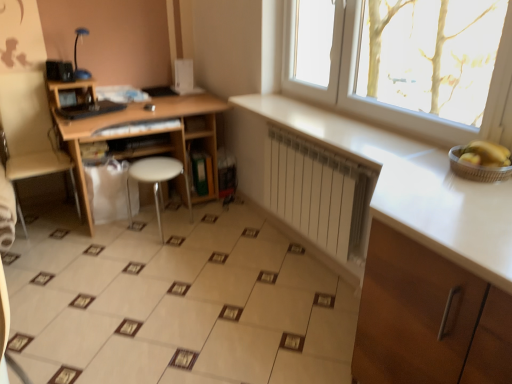
Describe the element at coordinates (160, 180) in the screenshot. I see `white plastic stool at center` at that location.

The width and height of the screenshot is (512, 384). Identify the location of white plastic stool at center. (160, 180).

Where is `beige fabric swivel chair at left`? The image size is (512, 384). beige fabric swivel chair at left is located at coordinates (30, 133).

What do you see at coordinates (30, 133) in the screenshot?
I see `beige fabric swivel chair at left` at bounding box center [30, 133].

At what (x,y) coordinates should I click in order to perform the action: click on metallic silver basket at right. Please return your answer as a coordinate pair (x, y). The height and width of the screenshot is (384, 512). Looking at the image, I should click on (476, 168).

Describe the element at coordinates (317, 192) in the screenshot. The height and width of the screenshot is (384, 512). I see `white matte radiator at center` at that location.

I want to click on white wood cabinet at lower right, so [x=428, y=318].

Where is `white plastic stool at center`? The image size is (512, 384). white plastic stool at center is located at coordinates (160, 180).

Does blue glossy lamp at upper left contain white matte radiator at center?

No, white matte radiator at center is not inside blue glossy lamp at upper left.

From the picture: From a real-world perspective, is blue glossy lamp at upper left over white matte radiator at center?

Yes, from a real-world perspective, blue glossy lamp at upper left is over white matte radiator at center

Does point (88, 33) appear closer or farther from the camera than point (292, 191)?

Point (88, 33) appears to be farther away from the viewer than point (292, 191).

Is white matte radiator at center wider than white wood cabinet at lower right?

In fact, white matte radiator at center might be narrower than white wood cabinet at lower right.

Which point is more distant from viewer, (355,188) or (434,330)?

The point (355,188) is farther from the camera.

Based on their sizes in the image, would you say white matte radiator at center is bigger or smaller than white wood cabinet at lower right?

white matte radiator at center is smaller than white wood cabinet at lower right.

Does white matte radiator at center lie behind white wood cabinet at lower right?

Yes, white matte radiator at center is further from the viewer.

Based on the photo, is blue glossy lamp at upper left looking in the opposite direction of metallic silver basket at right?

blue glossy lamp at upper left is not turned away from metallic silver basket at right.

In terms of size, does blue glossy lamp at upper left appear bigger or smaller than metallic silver basket at right?

Clearly, blue glossy lamp at upper left is larger in size than metallic silver basket at right.

Can you tell me how much blue glossy lamp at upper left and metallic silver basket at right differ in facing direction?

89.7 degrees separate the facing orientations of blue glossy lamp at upper left and metallic silver basket at right.

Which object is more forward, blue glossy lamp at upper left or metallic silver basket at right?

Positioned in front is metallic silver basket at right.

Where is `desk located on the left of beige ceramic tile at center`? desk located on the left of beige ceramic tile at center is located at coordinates (147, 132).

Is wooden desk at left aimed at beige ceramic tile at center?

Yes, wooden desk at left is facing beige ceramic tile at center.

Considering the sizes of objects wooden desk at left and beige ceramic tile at center in the image provided, who is taller, wooden desk at left or beige ceramic tile at center?

wooden desk at left is taller.

Based on the photo, is wooden desk at left in contact with beige ceramic tile at center?

No, wooden desk at left is not touching beige ceramic tile at center.

Between wooden desk at left and beige fabric swivel chair at left, which one appears on the left side from the viewer's perspective?

beige fabric swivel chair at left is more to the left.

Would you consider wooden desk at left to be distant from beige fabric swivel chair at left?

No, wooden desk at left is not far away from beige fabric swivel chair at left.

Looking at their sizes, would you say wooden desk at left is wider or thinner than beige fabric swivel chair at left?

Considering their sizes, wooden desk at left looks broader than beige fabric swivel chair at left.

Is wooden desk at left spatially inside beige fabric swivel chair at left, or outside of it?

wooden desk at left is spatially situated outside beige fabric swivel chair at left.

Does white wood cabinet at lower right have a lesser height compared to metallic silver basket at right?

No.

Is white wood cabinet at lower right positioned far away from metallic silver basket at right?

That's not correct — white wood cabinet at lower right is a little close to metallic silver basket at right.

From the image's perspective, which one is positioned higher, white wood cabinet at lower right or metallic silver basket at right?

From the image's view, metallic silver basket at right is above.

Measure the distance between white wood cabinet at lower right and metallic silver basket at right.

A distance of 23.36 inches exists between white wood cabinet at lower right and metallic silver basket at right.

Considering the sizes of wooden desk at left and blue glossy lamp at upper left in the image, is wooden desk at left bigger or smaller than blue glossy lamp at upper left?

In the image, wooden desk at left appears to be larger than blue glossy lamp at upper left.

Is point (198, 138) less distant than point (89, 74)?

No, (198, 138) is behind (89, 74).

Is wooden desk at left thinner than blue glossy lamp at upper left?

Incorrect, the width of wooden desk at left is not less than that of blue glossy lamp at upper left.

Which is behind, wooden desk at left or blue glossy lamp at upper left?

Positioned behind is blue glossy lamp at upper left.

In order to click on radiator beneath the blue glossy lamp at upper left (from a real-world perspective) in this screenshot , I will do `click(317, 192)`.

Where is `radiator to the left of white wood cabinet at lower right`? The image size is (512, 384). radiator to the left of white wood cabinet at lower right is located at coordinates (317, 192).

From the image, which object appears to be farther from wooden desk at left, beige fabric swivel chair at left or yellow matte banana at right?

yellow matte banana at right.

Based on their spatial positions, is metallic silver basket at right or beige fabric swivel chair at left closer to white plastic stool at center?

beige fabric swivel chair at left is closer to white plastic stool at center.

When comparing their distances from white wood cabinet at lower right, does metallic silver basket at right or beige fabric swivel chair at left seem further?

beige fabric swivel chair at left lies further to white wood cabinet at lower right than the other object.

Considering their positions, is metallic silver basket at right positioned further to yellow matte banana at right than wooden desk at left?

wooden desk at left is positioned further to the anchor yellow matte banana at right.

Based on their spatial positions, is white plastic stool at center or white wood cabinet at lower right closer to white matte radiator at center?

white wood cabinet at lower right is closer to white matte radiator at center.

Looking at the image, which one is located closer to beige ceramic tile at center, blue glossy lamp at upper left or white wood cabinet at lower right?

Among the two, white wood cabinet at lower right is located nearer to beige ceramic tile at center.

Which object lies nearer to the anchor point white plastic stool at center, white matte radiator at center or blue glossy lamp at upper left?

blue glossy lamp at upper left is positioned closer to the anchor white plastic stool at center.

Based on their spatial positions, is white plastic stool at center or metallic silver basket at right closer to blue glossy lamp at upper left?

Based on the image, white plastic stool at center appears to be nearer to blue glossy lamp at upper left.

The image size is (512, 384). Identify the location of desk situated between beige fabric swivel chair at left and yellow matte banana at right from left to right. (147, 132).

This screenshot has width=512, height=384. Find the location of `radiator situated between beige fabric swivel chair at left and metallic silver basket at right from left to right`. radiator situated between beige fabric swivel chair at left and metallic silver basket at right from left to right is located at coordinates (317, 192).

I want to click on lamp between beige fabric swivel chair at left and white matte radiator at center, so click(76, 56).

Locate an element on the screen. The image size is (512, 384). swivel chair between blue glossy lamp at upper left and white plastic stool at center vertically is located at coordinates (30, 133).